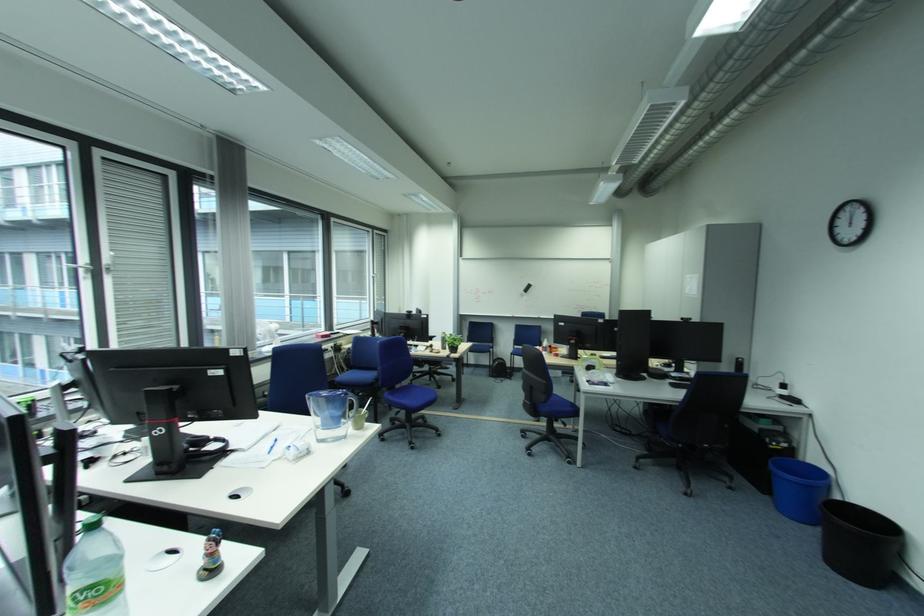
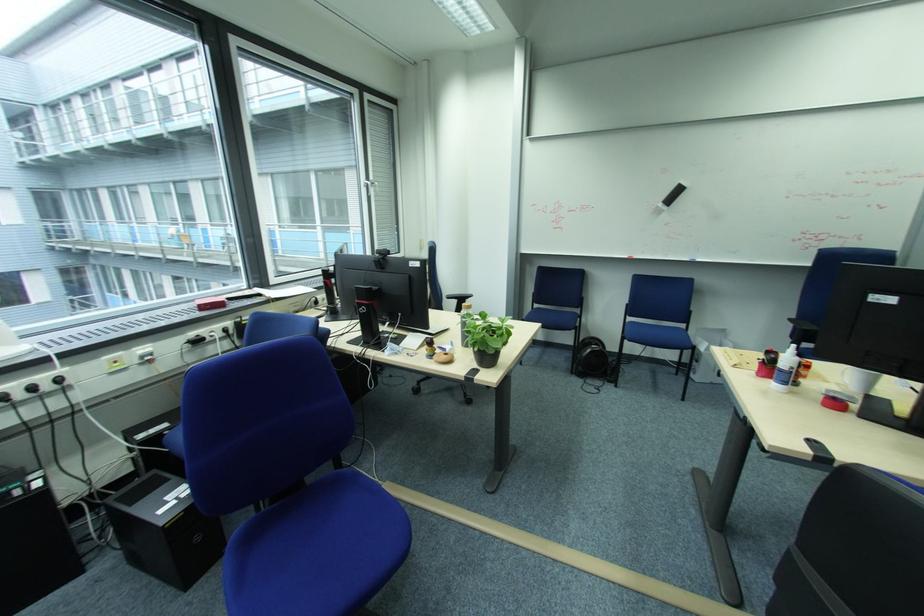
Find the pixel in the second image that matches (520,355) in the first image.

(633, 339)